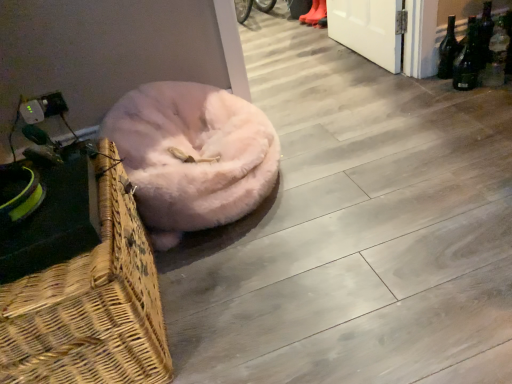
Question: Is fuzzy pink dog bed at lower left turned away from green glass bottle at right, acting as the third bottle starting from the left?

Choices:
 (A) no
 (B) yes

Answer: (A)

Question: Can you confirm if fuzzy pink dog bed at lower left is bigger than green glass bottle at right, positioned as the 1th bottle in right-to-left order?

Choices:
 (A) yes
 (B) no

Answer: (A)

Question: Is fuzzy pink dog bed at lower left facing towards green glass bottle at right, acting as the third bottle starting from the left?

Choices:
 (A) no
 (B) yes

Answer: (A)

Question: From the image's perspective, is fuzzy pink dog bed at lower left on top of green glass bottle at right, positioned as the 1th bottle in right-to-left order?

Choices:
 (A) no
 (B) yes

Answer: (A)

Question: Can you confirm if fuzzy pink dog bed at lower left is shorter than green glass bottle at right, positioned as the 1th bottle in right-to-left order?

Choices:
 (A) yes
 (B) no

Answer: (B)

Question: Can you confirm if fuzzy pink dog bed at lower left is taller than green glass bottle at right, positioned as the 1th bottle in right-to-left order?

Choices:
 (A) no
 (B) yes

Answer: (B)

Question: Is orange rubber boots at upper center wider than dark green glass bottle at upper right, which appears as the 2th bottle when viewed from the left?

Choices:
 (A) no
 (B) yes

Answer: (B)

Question: Is orange rubber boots at upper center oriented away from dark green glass bottle at upper right, the 2th bottle from the right?

Choices:
 (A) no
 (B) yes

Answer: (A)

Question: Can you confirm if orange rubber boots at upper center is bigger than dark green glass bottle at upper right, which appears as the 2th bottle when viewed from the left?

Choices:
 (A) yes
 (B) no

Answer: (A)

Question: Is the depth of orange rubber boots at upper center less than that of dark green glass bottle at upper right, the 2th bottle from the right?

Choices:
 (A) no
 (B) yes

Answer: (A)

Question: Is orange rubber boots at upper center positioned behind dark green glass bottle at upper right, which appears as the 2th bottle when viewed from the left?

Choices:
 (A) no
 (B) yes

Answer: (B)

Question: Would you say orange rubber boots at upper center is outside dark green glass bottle at upper right, the 2th bottle from the right?

Choices:
 (A) yes
 (B) no

Answer: (A)

Question: From a real-world perspective, does orange rubber boots at upper center stand above woven wood picnic basket at lower left?

Choices:
 (A) yes
 (B) no

Answer: (B)